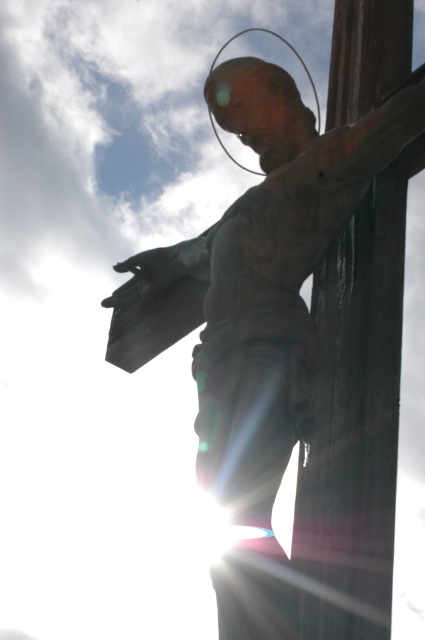
You are standing in front of the bronze statue at center. If you want to take a photo of the statue with your smartphone, which has a maximum zoom range of 10 feet, will you be able to capture the entire statue without moving closer?

The bronze statue at center is 36.83 feet from viewer. Since the smartphone has a maximum zoom range of 10 feet, you will not be able to capture the entire statue without moving closer.

You are an art student analyzing the composition of the image. You notice the bronze statue at center and the wooden post at right. Based on their sizes, which one appears smaller in the artwork?

The bronze statue at center appears smaller than the wooden post at right because it has a lesser height compared to the wooden post at right.

Looking at this image, you are standing in front of the statue of Jesus Christ on the cross and notice two points marked in the image. The first point is located at coordinates point (246,88) and the second at point (384,380). From your perspective, which point is closer to you?

Point (384,380) is closer to you because it is in front of point (246,88) according to their spatial arrangement.